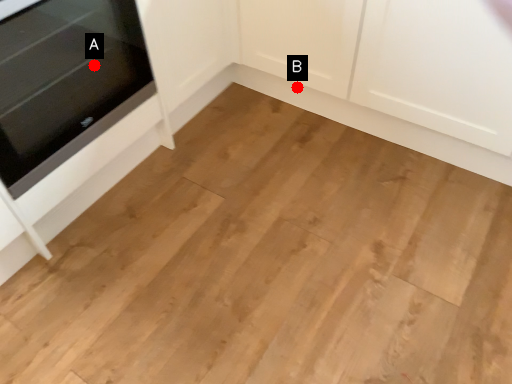
Question: Two points are circled on the image, labeled by A and B beside each circle. Among these points, which one is nearest to the camera?

Choices:
 (A) A is closer
 (B) B is closer

Answer: (A)